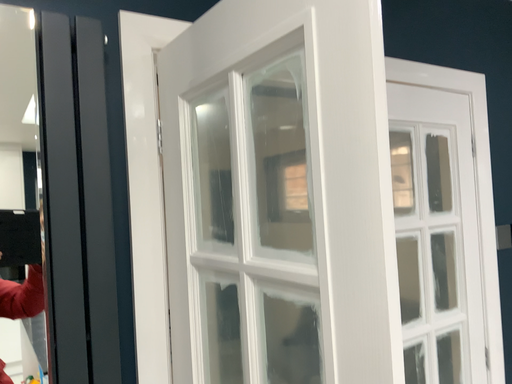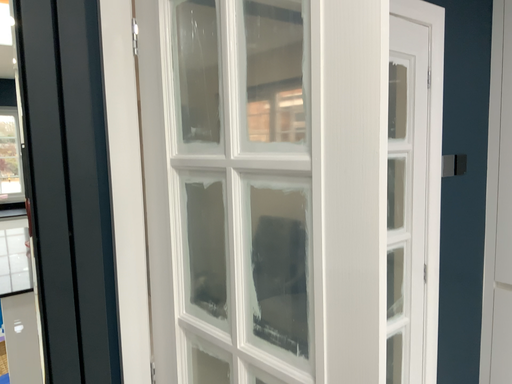
Question: How did the camera likely rotate when shooting the video?

Choices:
 (A) rotated downward
 (B) rotated upward

Answer: (A)